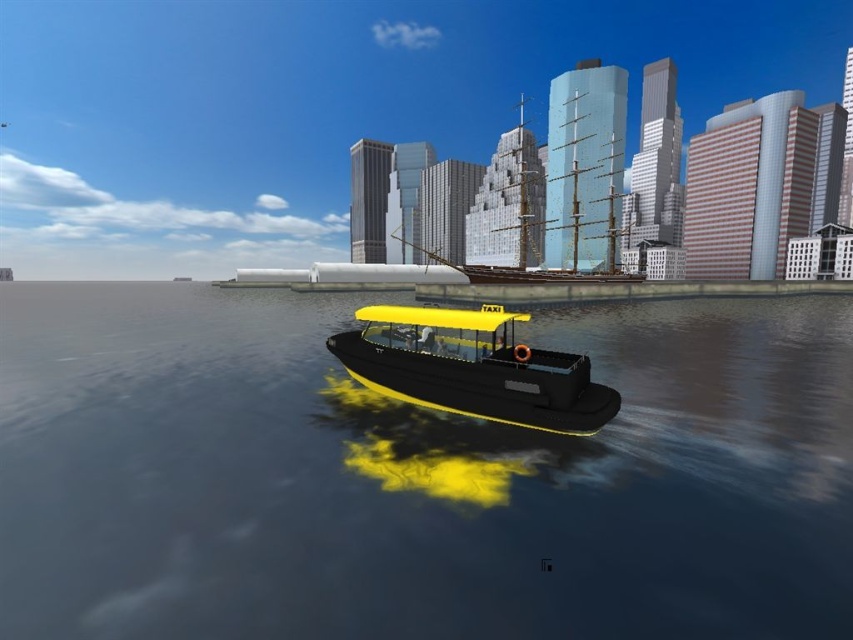
Can you confirm if glossy water at boat center is wider than yellow matte taxi boat at center?

Yes, glossy water at boat center is wider than yellow matte taxi boat at center.

Is glossy water at boat center to the right of yellow matte taxi boat at center from the viewer's perspective?

No, glossy water at boat center is not to the right of yellow matte taxi boat at center.

Describe the element at coordinates (415, 476) in the screenshot. I see `glossy water at boat center` at that location.

Where is `glossy water at boat center`? The image size is (853, 640). glossy water at boat center is located at coordinates (415, 476).

Can you confirm if yellow matte taxi boat at center is thinner than wooden ship at center?

Yes.

Describe the element at coordinates (473, 368) in the screenshot. I see `yellow matte taxi boat at center` at that location.

Is point (546, 422) positioned in front of point (560, 268)?

Yes, it is.

Image resolution: width=853 pixels, height=640 pixels. In order to click on yellow matte taxi boat at center in this screenshot , I will do `click(473, 368)`.

Is point (664, 356) positioned after point (608, 182)?

No, it is not.

Does glossy water at boat center have a smaller size compared to wooden ship at center?

Yes.

At what (x,y) coordinates should I click in order to perform the action: click on glossy water at boat center. Please return your answer as a coordinate pair (x, y). The width and height of the screenshot is (853, 640). Looking at the image, I should click on (415, 476).